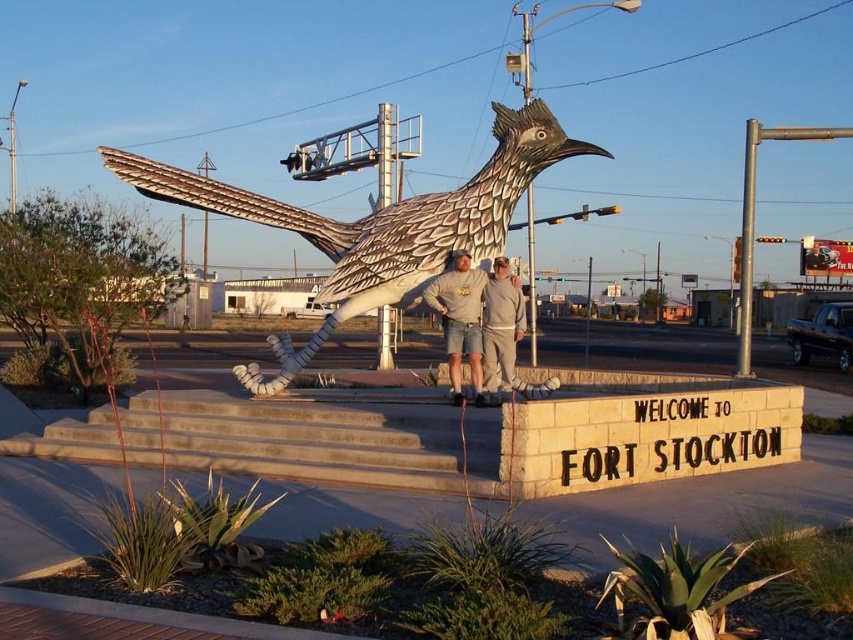
Question: Where is white painted wood roadrunner at center located in relation to gray cotton sweatshirt at center in the image?

Choices:
 (A) below
 (B) above

Answer: (B)

Question: Which object is the farthest from the gray cotton sweatshirt at center?

Choices:
 (A) gray fleece sweatshirt at center
 (B) white painted wood roadrunner at center

Answer: (B)

Question: Which of these objects is positioned closest to the white painted wood roadrunner at center?

Choices:
 (A) gray fleece sweatshirt at center
 (B) gray cotton sweatshirt at center

Answer: (A)

Question: Among these objects, which one is nearest to the camera?

Choices:
 (A) white painted wood roadrunner at center
 (B) gray fleece sweatshirt at center
 (C) gray cotton sweatshirt at center

Answer: (C)

Question: Does gray cotton sweatshirt at center have a greater width compared to gray fleece sweatshirt at center?

Choices:
 (A) yes
 (B) no

Answer: (A)

Question: Does white painted wood roadrunner at center come in front of gray cotton sweatshirt at center?

Choices:
 (A) yes
 (B) no

Answer: (B)